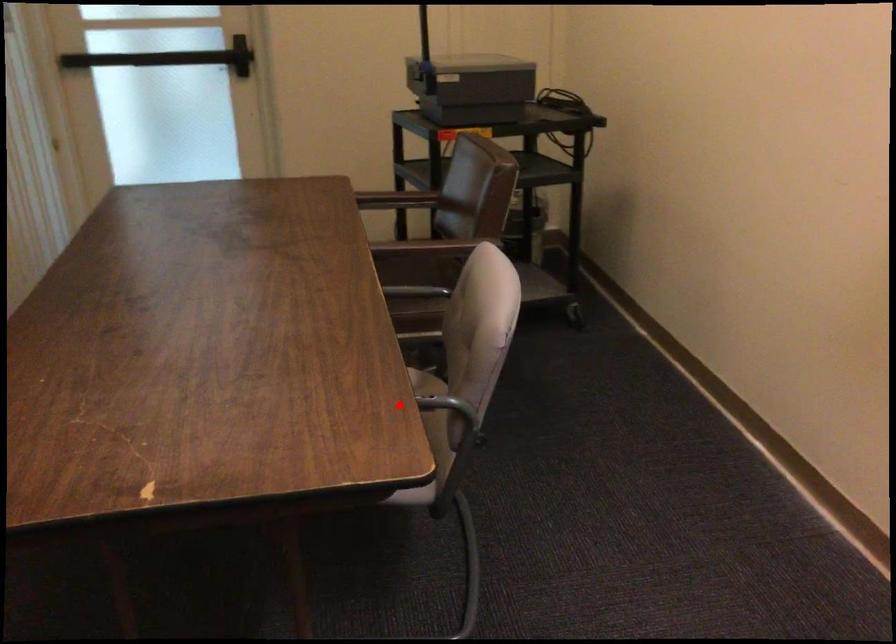
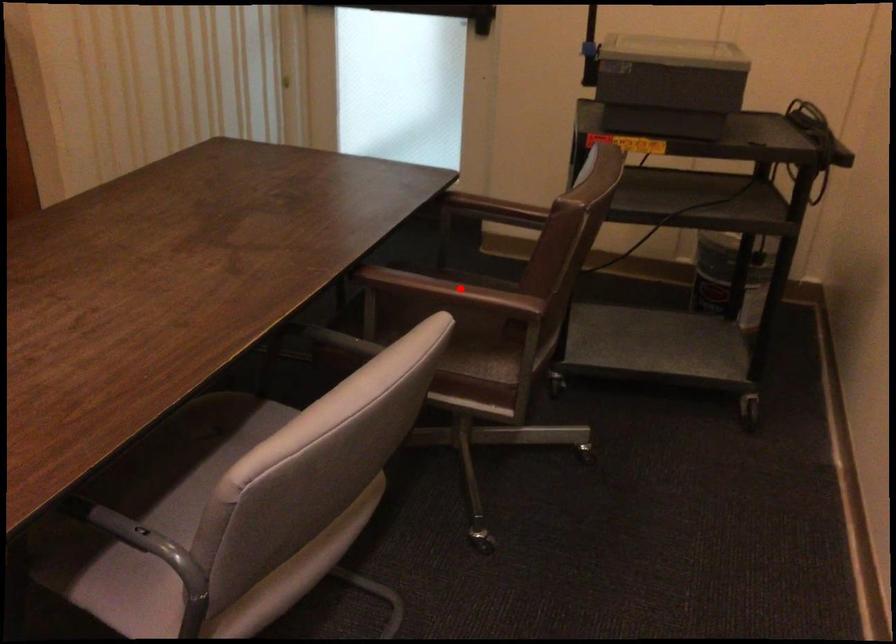
I am providing you with two images of the same scene from different viewpoints. A red point is marked on the first image and another point is marked on the second image. Does the point marked in image1 correspond to the same location as the one in image2?

No